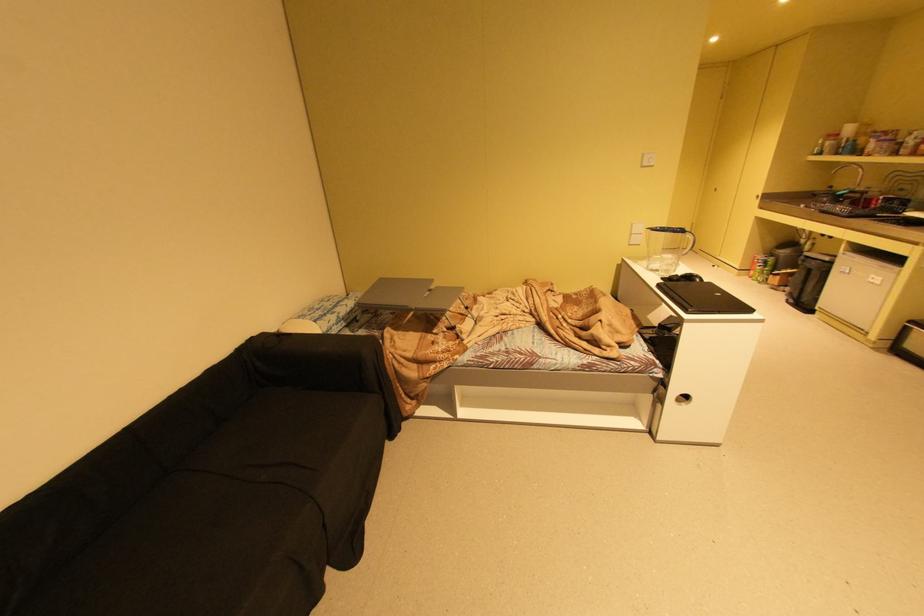
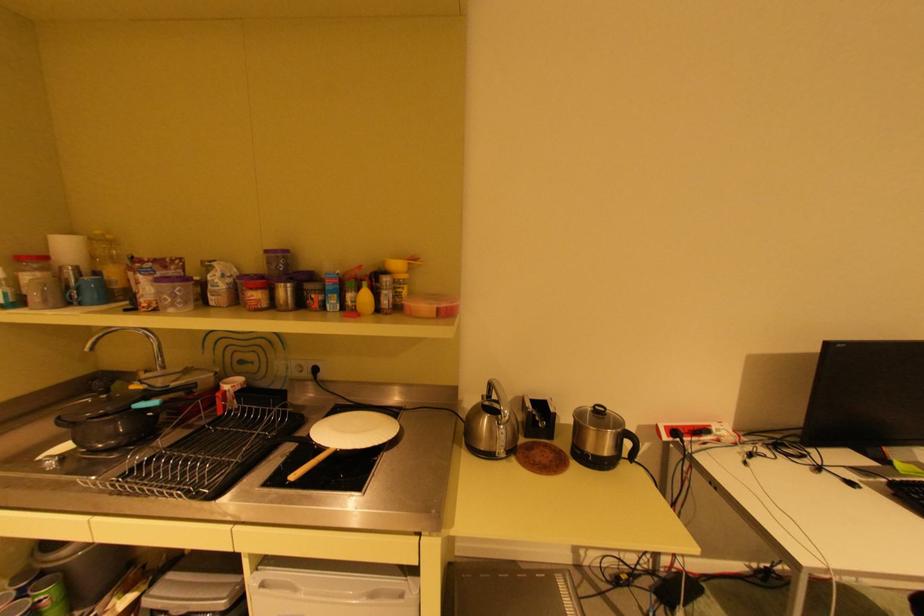
The point at (844, 155) is marked in the first image. Where is the corresponding point in the second image?

(79, 302)